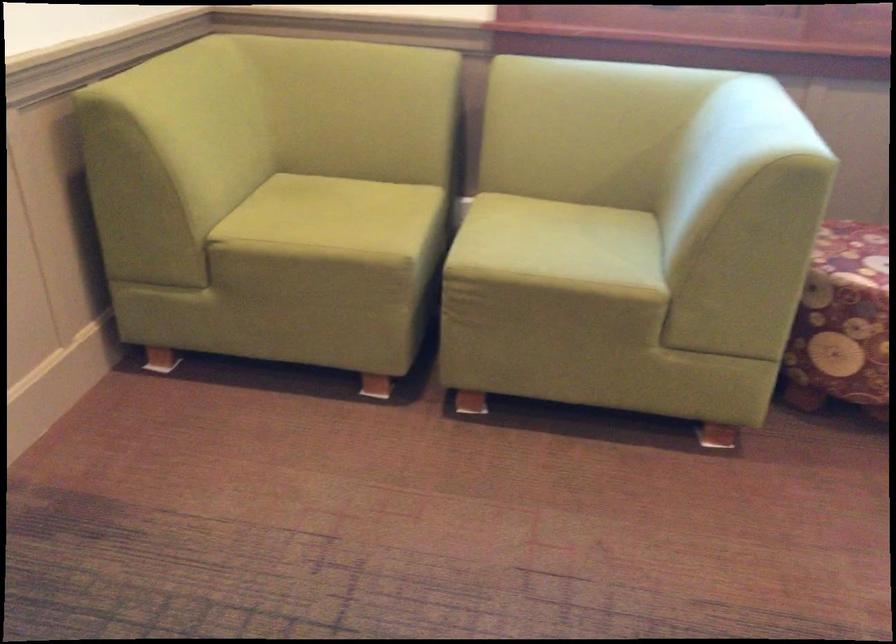
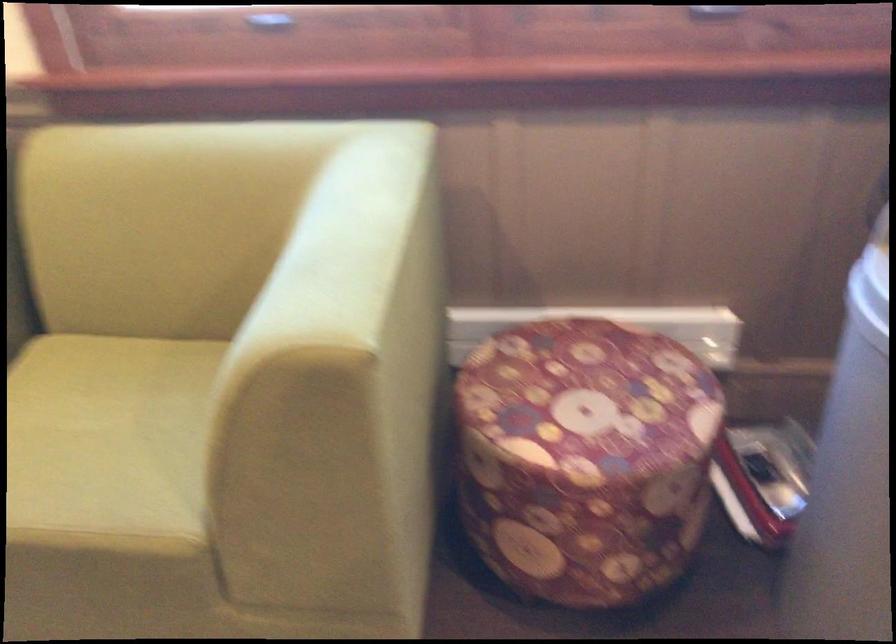
Where in the second image is the point corresponding to pixel 564 243 from the first image?

(107, 442)